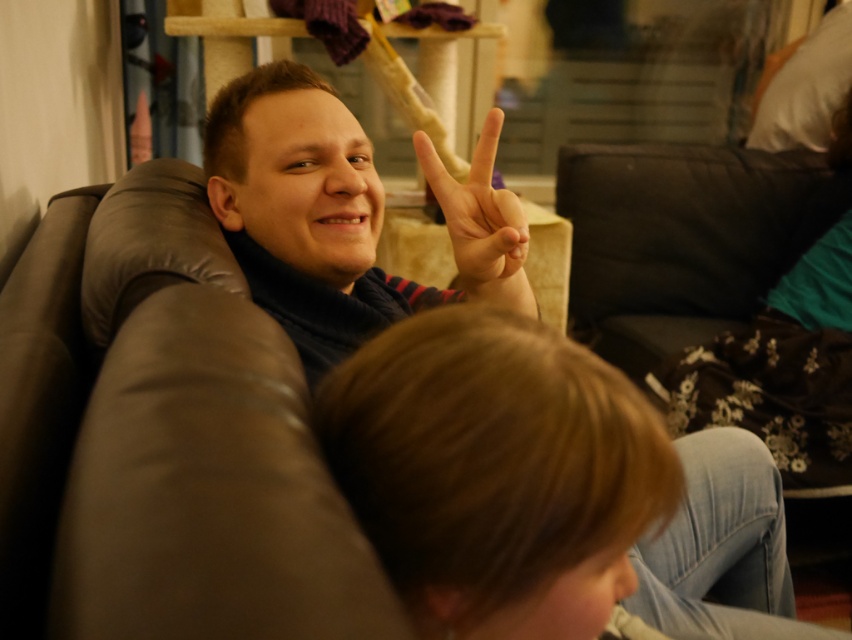
Between point (223, 225) and point (511, 228), which one is positioned in front?

Point (511, 228) is in front.

Who is positioned more to the left, matte black scarf at center or matte skin hand at center?

matte black scarf at center

Who is more forward, (245,252) or (488,269)?

Point (488,269) is more forward.

Identify the location of matte black scarf at center. (343, 214).

Is matte black scarf at upper center positioned in front of matte skin hand at center?

No.

Who is positioned more to the right, matte black scarf at upper center or matte skin hand at center?

matte skin hand at center

Measure the distance between point (274, 100) and camera.

The distance of point (274, 100) from camera is 36.87 inches.

Image resolution: width=852 pixels, height=640 pixels. What are the coordinates of `matte black scarf at upper center` in the screenshot? It's located at (341, 214).

Between blonde hair at lower center and matte skin hand at center, which one has less height?

matte skin hand at center

This screenshot has width=852, height=640. Find the location of `blonde hair at lower center`. blonde hair at lower center is located at coordinates (494, 472).